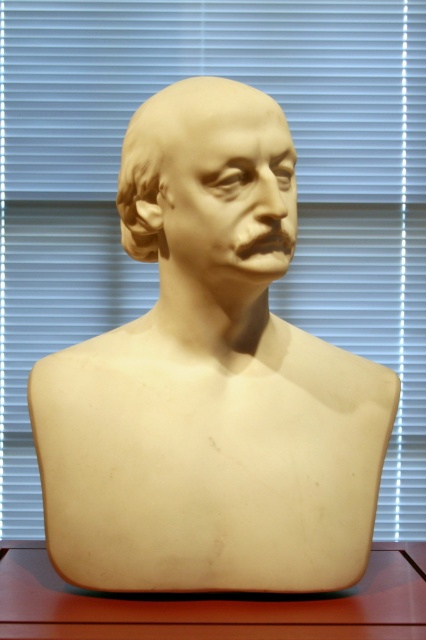
Question: Is matte beige bust at center to the right of matte wood table at center from the viewer's perspective?

Choices:
 (A) no
 (B) yes

Answer: (A)

Question: Is white marble bust at center to the left of matte wood table at center from the viewer's perspective?

Choices:
 (A) no
 (B) yes

Answer: (A)

Question: Which point is farther to the camera?

Choices:
 (A) matte beige bust at center
 (B) white marble bust at center

Answer: (B)

Question: Which of the following is the closest to the observer?

Choices:
 (A) matte beige bust at center
 (B) matte wood table at center
 (C) white marble bust at center

Answer: (B)

Question: Which of these objects is positioned farthest from the white marble bust at center?

Choices:
 (A) matte wood table at center
 (B) matte beige bust at center

Answer: (A)

Question: Is white marble bust at center further to camera compared to matte beige bust at center?

Choices:
 (A) no
 (B) yes

Answer: (B)